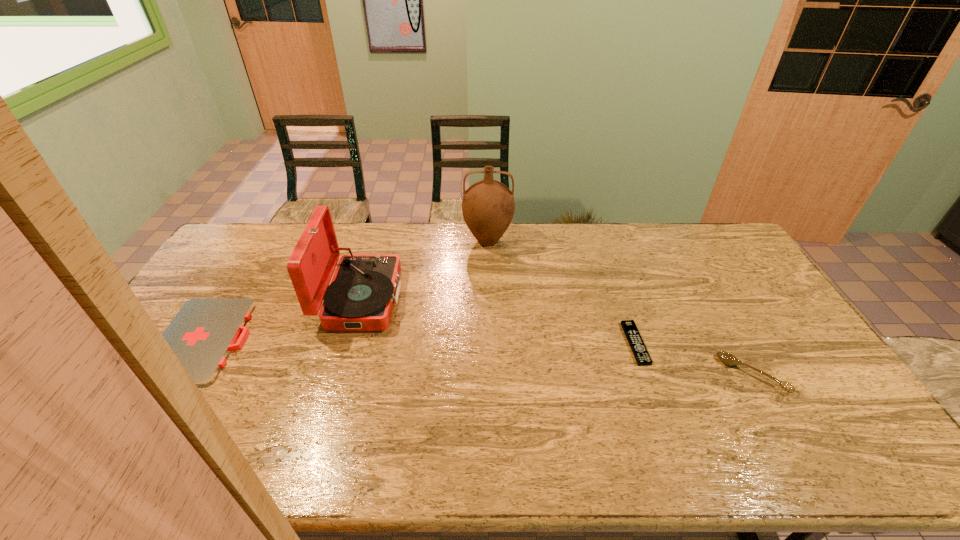
At what (x,y) coordinates should I click in order to perform the action: click on vacant space that satisfies the following two spatial constraints: 1. on handle side the first-aid kit; 2. on the right side of the shortest object. Please return your answer as a coordinate pair (x, y). The width and height of the screenshot is (960, 540). Looking at the image, I should click on 203,343.

You are a GUI agent. You are given a task and a screenshot of the screen. Output one action in this format:
    pyautogui.click(x=<x>, y=<y>)
    Task: Click on the free space in the image that satisfies the following two spatial constraints: 1. on the front side of the second object from right to left; 2. on the right side of the farthest object
    The width and height of the screenshot is (960, 540).
    Given the screenshot: What is the action you would take?
    pyautogui.click(x=491, y=343)

Locate an element on the screen. This screenshot has width=960, height=540. vacant point that satisfies the following two spatial constraints: 1. on the front-facing side of the rightmost object; 2. on the left side of the fourth object from right to left is located at coordinates (339, 374).

Locate an element on the screen. The width and height of the screenshot is (960, 540). free space that satisfies the following two spatial constraints: 1. on handle side the rightmost object; 2. on the right side of the fourth tallest object is located at coordinates (183, 374).